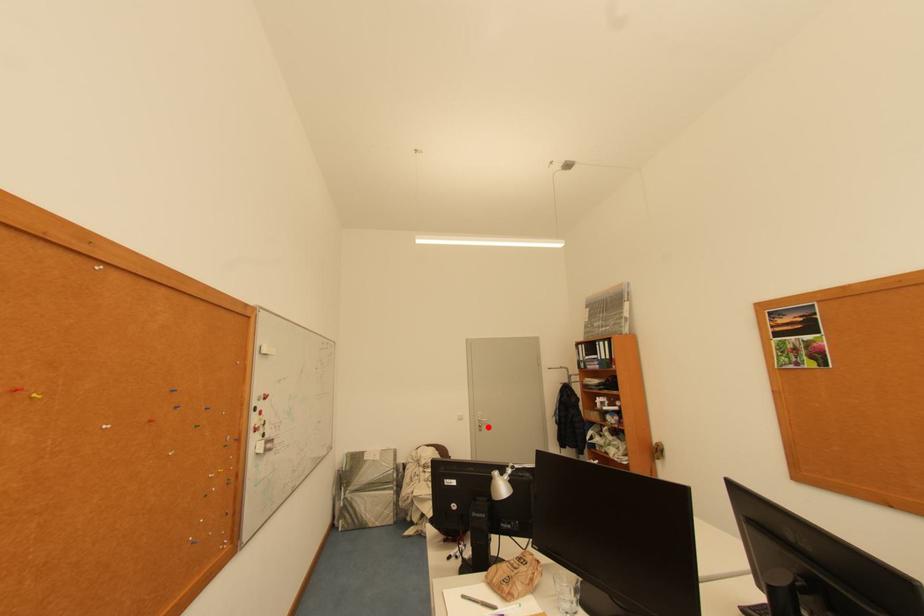
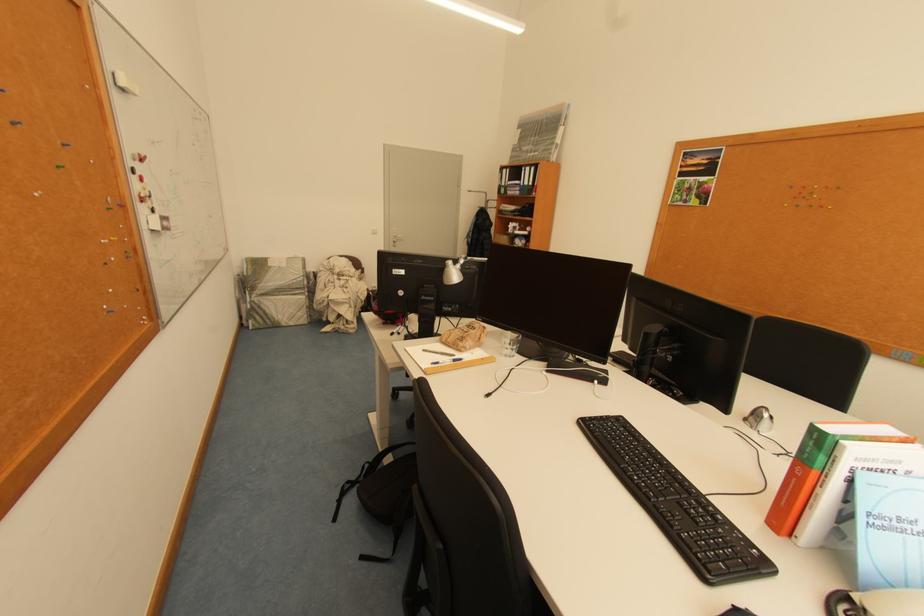
Question: I am providing you with two images of the same scene from different viewpoints. In image1, a red point is highlighted. Considering the same 3D point in image2, which of the following is correct?

Choices:
 (A) It is closer
 (B) It is farther

Answer: (B)